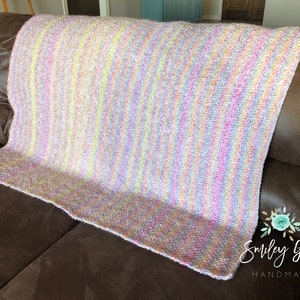
This screenshot has height=300, width=300. Find the location of `couch cushions`. couch cushions is located at coordinates (71, 266), (19, 228).